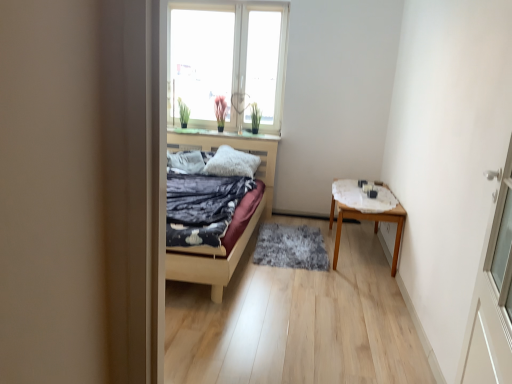
At what (x,y) coordinates should I click in order to perform the action: click on vacant space in gray shaggy rug at center (from a real-world perspective). Please return your answer as a coordinate pair (x, y). Looking at the image, I should click on (293, 244).